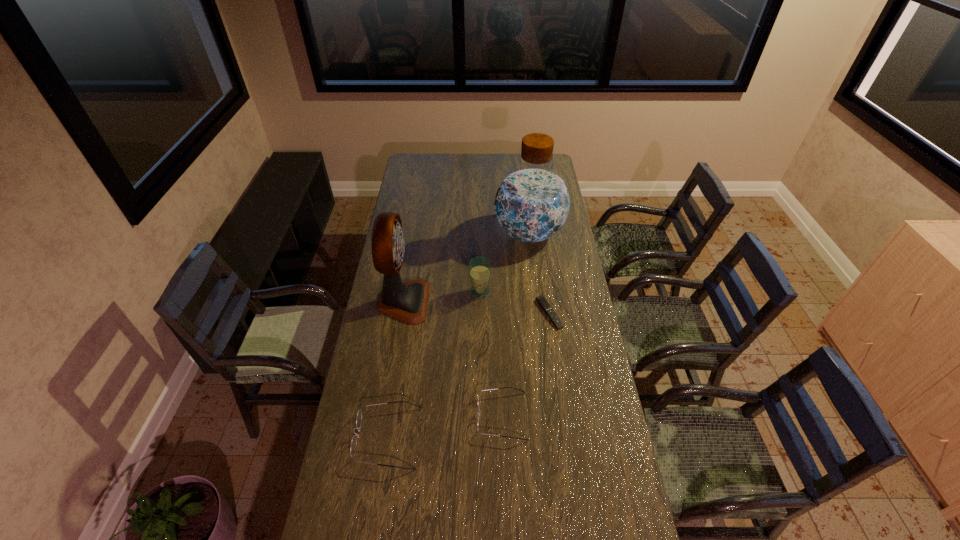
The image size is (960, 540). I want to click on vacant space located through the lenses of the right spectacles, so click(x=439, y=416).

Locate an element on the screen. This screenshot has height=540, width=960. vacant space situated on the left of the glass is located at coordinates (382, 292).

Image resolution: width=960 pixels, height=540 pixels. I want to click on free space located 0.210m on the front-facing side of the fan, so click(x=477, y=302).

Where is `free space located on the front of the water jug`? This screenshot has height=540, width=960. free space located on the front of the water jug is located at coordinates (533, 266).

Locate an element on the screen. vacant area situated 0.120m on the back of the remote control is located at coordinates (544, 278).

You are a GUI agent. You are given a task and a screenshot of the screen. Output one action in this format:
    pyautogui.click(x=<x>, y=<y>)
    Task: Click on the spectacles that is at the left edge
    The width and height of the screenshot is (960, 540).
    Given the screenshot: What is the action you would take?
    pyautogui.click(x=353, y=446)

Where is `fan that is at the left edge`? The image size is (960, 540). fan that is at the left edge is located at coordinates (407, 302).

Where is `water jug located in the right edge section of the desktop`? Image resolution: width=960 pixels, height=540 pixels. water jug located in the right edge section of the desktop is located at coordinates (532, 203).

This screenshot has width=960, height=540. I want to click on remote control that is at the right edge, so click(x=543, y=303).

Image resolution: width=960 pixels, height=540 pixels. Identify the location of vacant space at the far edge of the desktop. (444, 156).